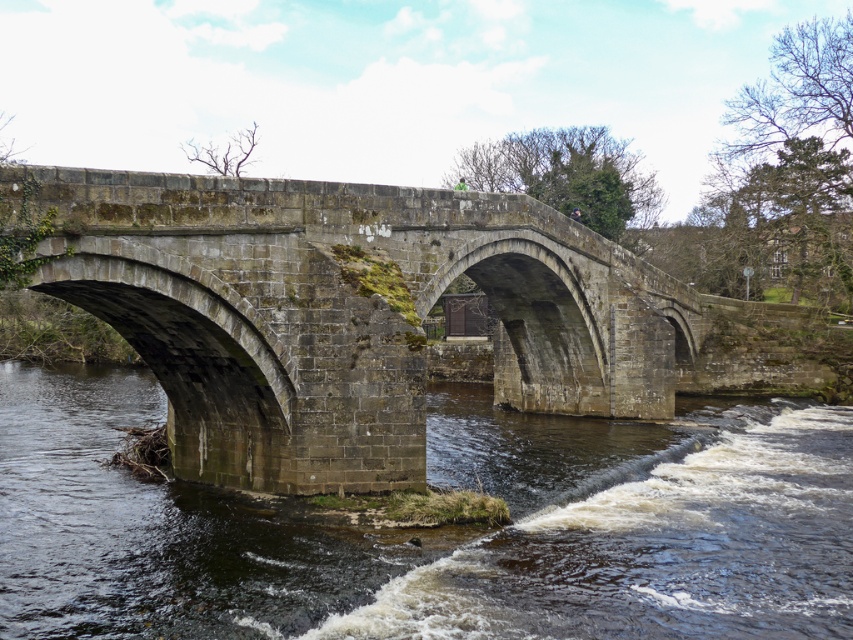
Question: In this image, where is dark brown stone river at lower left located relative to stone bridge at center?

Choices:
 (A) above
 (B) below

Answer: (B)

Question: Can you confirm if dark brown stone river at lower left is positioned to the left of stone bridge at center?

Choices:
 (A) no
 (B) yes

Answer: (B)

Question: Which point appears farthest from the camera in this image?

Choices:
 (A) (51, 253)
 (B) (625, 445)

Answer: (B)

Question: Does dark brown stone river at lower left lie behind stone bridge at center?

Choices:
 (A) no
 (B) yes

Answer: (A)